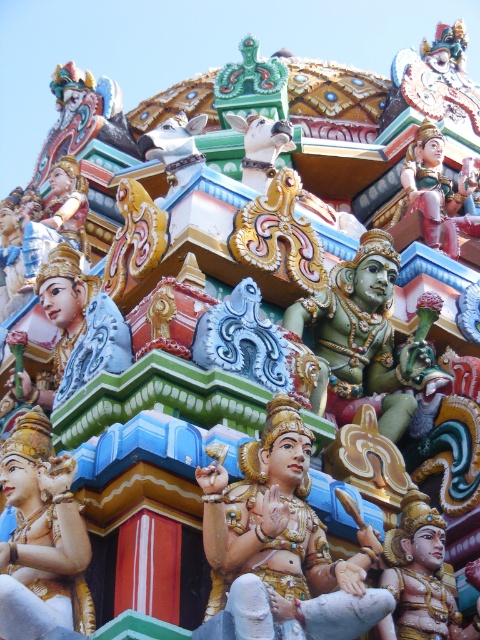
In the scene shown: Is gold polished statue at center bigger than matte gold statue at center?

Actually, gold polished statue at center might be smaller than matte gold statue at center.

The image size is (480, 640). What are the coordinates of `gold polished statue at center` in the screenshot? It's located at (41, 538).

Locate an element on the screen. gold polished statue at center is located at coordinates (41, 538).

Is polished gold statue at center closer to camera compared to green polished statue at center?

That is True.

Who is shorter, polished gold statue at center or green polished statue at center?

polished gold statue at center is shorter.

Is point (330, 593) positioned after point (360, 236)?

No, (330, 593) is closer to viewer.

Locate an element on the screen. This screenshot has height=640, width=480. polished gold statue at center is located at coordinates pos(282,544).

Can you confirm if gold polished statue at center is positioned to the right of green polished statue at center?

In fact, gold polished statue at center is to the left of green polished statue at center.

Is point (17, 512) behind point (348, 333)?

That is False.

Does point (93, 625) come farther from viewer compared to point (406, 356)?

That is False.

This screenshot has width=480, height=640. I want to click on gold polished statue at center, so click(x=41, y=538).